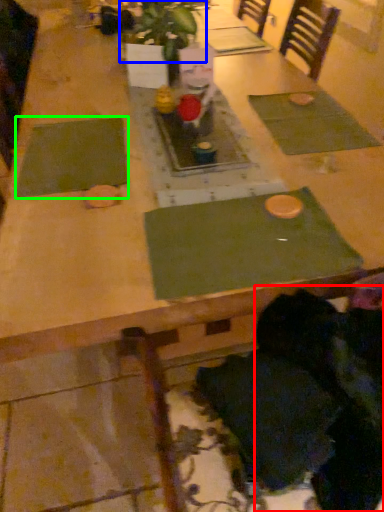
Question: Which object is positioned closest to person (highlighted by a red box)? Select from plant (highlighted by a blue box) and place mat (highlighted by a green box).

Choices:
 (A) plant
 (B) place mat

Answer: (B)